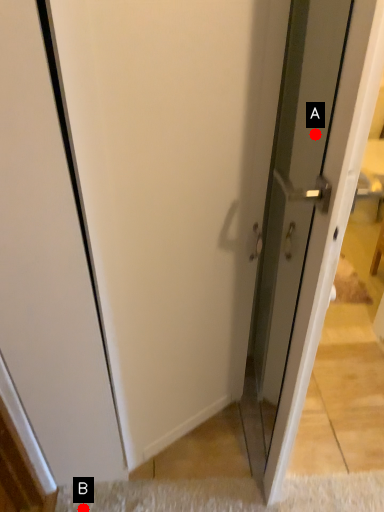
Question: Two points are circled on the image, labeled by A and B beside each circle. Among these points, which one is nearest to the camera?

Choices:
 (A) A is closer
 (B) B is closer

Answer: (A)